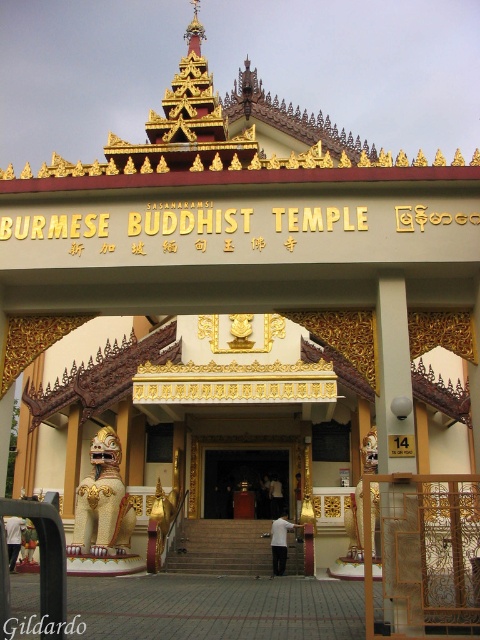
Which is below, polished wood door at center or blacktexturedwriting at center?

polished wood door at center is below.

From the picture: Is polished wood door at center taller than blacktexturedwriting at center?

Yes.

Where is `polished wood door at center`? polished wood door at center is located at coordinates (244, 481).

The image size is (480, 640). I want to click on polished wood door at center, so click(x=244, y=481).